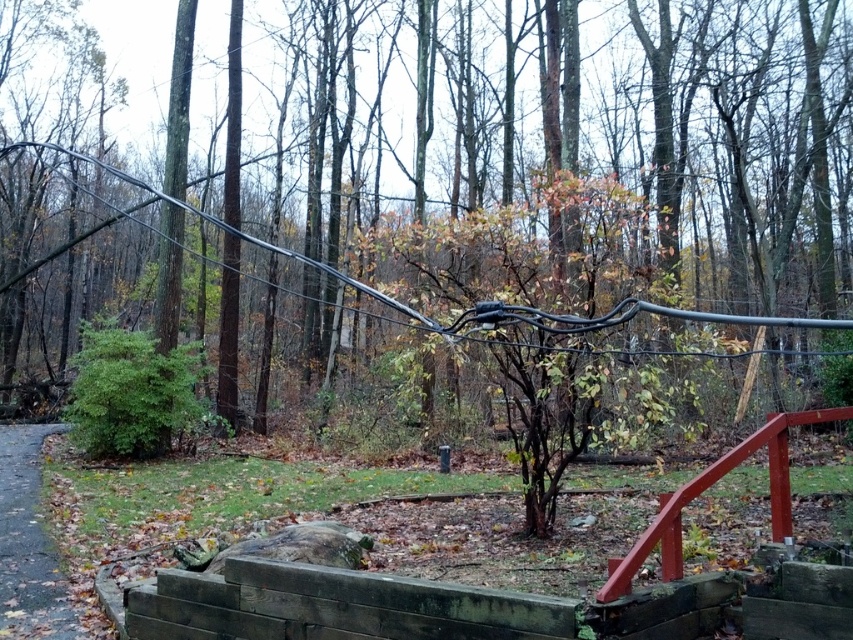
You are standing at the edge of the wooded area and see the green matte tree at center and the smooth red wooden rail at lower right. Which object is positioned to the left of the other?

The green matte tree at center is to the left of the smooth red wooden rail at lower right.